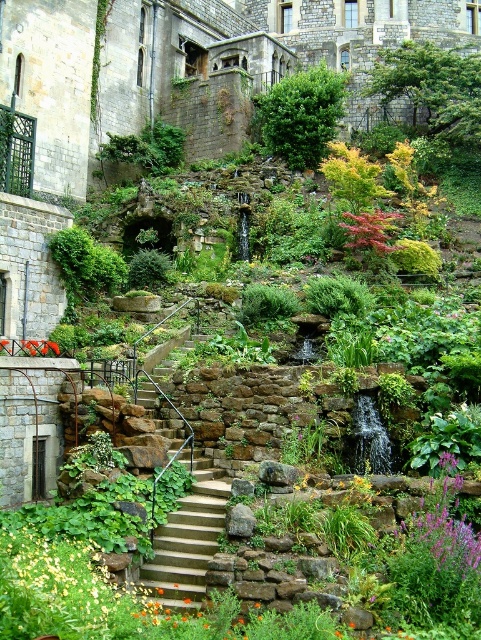
Based on the photo, you are standing at the top of the smooth concrete stairs at center in the garden. If you look straight ahead, which direction do you face relative to the historic stone building?

You are facing away from the historic stone building because the smooth concrete stairs at center lead down from the building towards the garden, so standing at the top would have you facing the garden and away from the building.

You are a gardener who needs to place a new decorative pot that is 1 meter wide between the smooth concrete stairs at center and the purple fuzzy flower at center right. Based on the scene description, will the pot fit between them without overlapping either object?

The smooth concrete stairs at center is wider than the purple fuzzy flower at center right. However, the exact distance between them isn

You are standing in the garden looking towards the historic stone building. There are two points marked in the image. The first point is at coordinate (418,531) and the second is at (370,236). Which point is closer to you?

Point (418,531) is closer to the viewer than point (370,236).